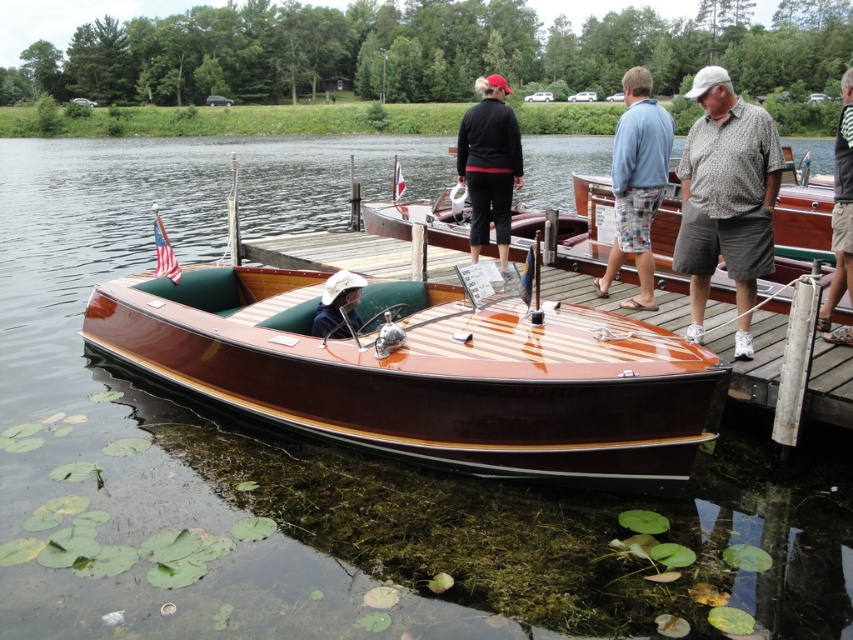
Is gray striped shirt at right above white cloth hat at center?

Yes, gray striped shirt at right is above white cloth hat at center.

Locate an element on the screen. Image resolution: width=853 pixels, height=640 pixels. gray striped shirt at right is located at coordinates (840, 220).

The image size is (853, 640). Describe the element at coordinates (840, 220) in the screenshot. I see `gray striped shirt at right` at that location.

The image size is (853, 640). In order to click on gray striped shirt at right in this screenshot , I will do `click(840, 220)`.

From the picture: Measure the distance between glossy wood dock at center and printed cotton shirt at right.

glossy wood dock at center is 9.74 feet from printed cotton shirt at right.

Is glossy wood dock at center shorter than printed cotton shirt at right?

No, glossy wood dock at center is not shorter than printed cotton shirt at right.

Measure the distance between point (753, 332) and camera.

A distance of 6.53 meters exists between point (753, 332) and camera.

Locate an element on the screen. This screenshot has width=853, height=640. glossy wood dock at center is located at coordinates (581, 266).

Can you confirm if mahogany wood boat at center is positioned to the right of blue plaid shorts at center?

No, mahogany wood boat at center is not to the right of blue plaid shorts at center.

The width and height of the screenshot is (853, 640). What do you see at coordinates (427, 374) in the screenshot?
I see `mahogany wood boat at center` at bounding box center [427, 374].

Is point (492, 346) positioned in front of point (642, 221)?

Yes, point (492, 346) is in front of point (642, 221).

Find the location of a particular element. mahogany wood boat at center is located at coordinates (427, 374).